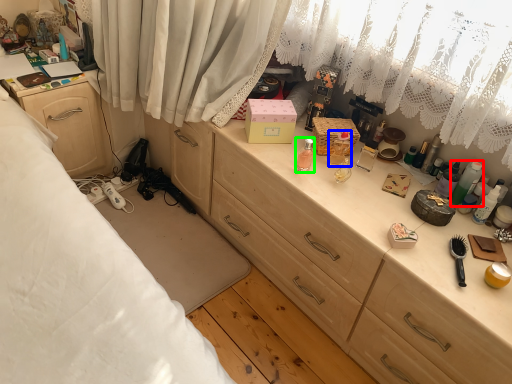
Question: Based on their relative distances, which object is farther from toiletry (highlighted by a red box)? Choose from toiletry (highlighted by a blue box) and toiletry (highlighted by a green box).

Choices:
 (A) toiletry
 (B) toiletry

Answer: (B)